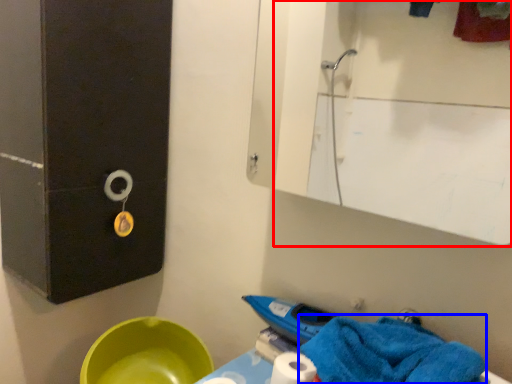
Question: Which point is closer to the camera, mirror (highlighted by a red box) or bath towel (highlighted by a blue box)?

Choices:
 (A) mirror
 (B) bath towel

Answer: (B)